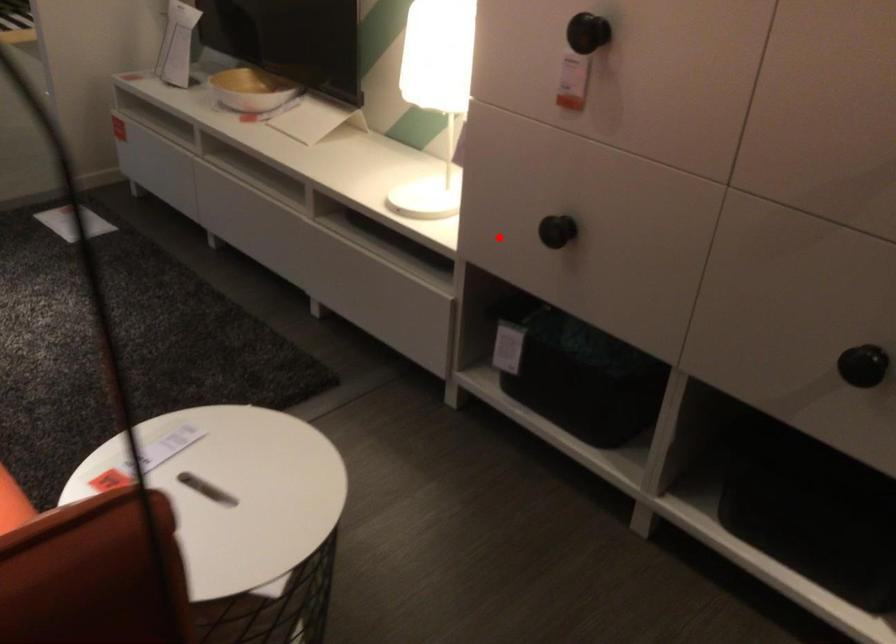
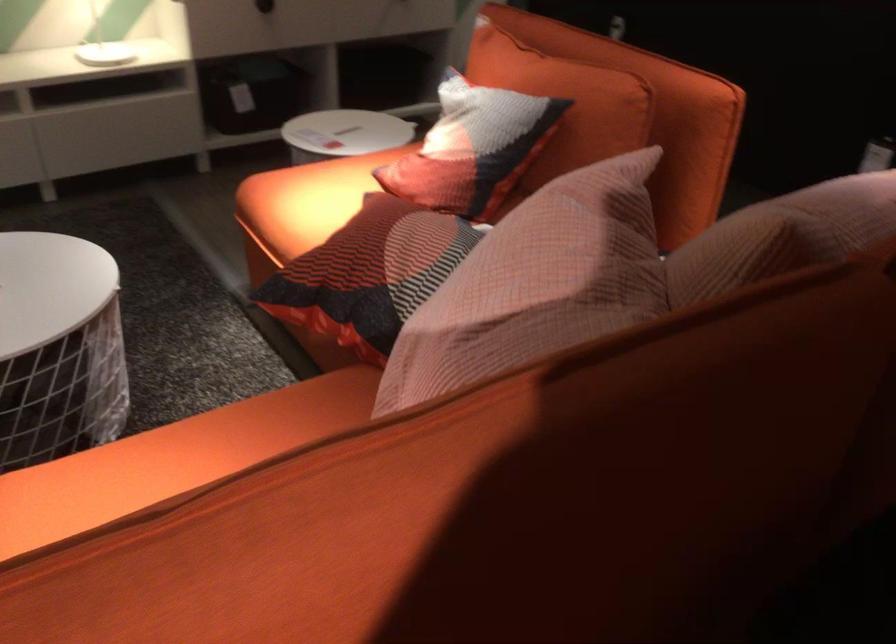
In the second image, find the point that corresponds to the highlighted location in the first image.

(264, 6)